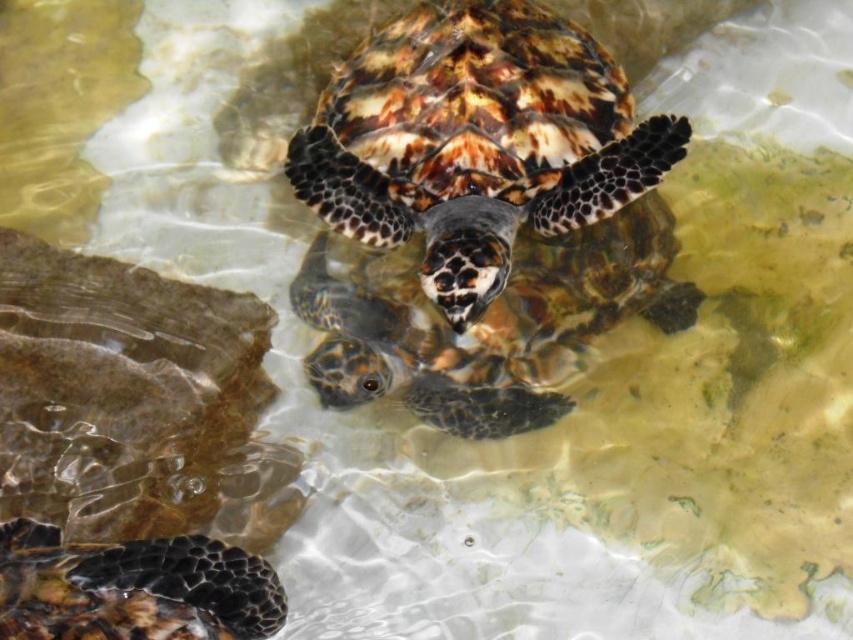
Between leopard print shell at center and patterned shell at lower left, which one is positioned higher?

leopard print shell at center is above.

You are a GUI agent. You are given a task and a screenshot of the screen. Output one action in this format:
    pyautogui.click(x=<x>, y=<y>)
    Task: Click on the leopard print shell at center
    This screenshot has height=640, width=853.
    Given the screenshot: What is the action you would take?
    pyautogui.click(x=476, y=141)

Is point (514, 154) closer to camera compared to point (59, 632)?

No, it is behind (59, 632).

Identify the location of leopard print shell at center. (476, 141).

Can you confirm if leopard print shell at center is positioned to the left of leathery brown tortoise at center?

Incorrect, leopard print shell at center is not on the left side of leathery brown tortoise at center.

The height and width of the screenshot is (640, 853). What do you see at coordinates (476, 141) in the screenshot?
I see `leopard print shell at center` at bounding box center [476, 141].

This screenshot has height=640, width=853. In order to click on leopard print shell at center in this screenshot , I will do `click(476, 141)`.

Can you confirm if patterned shell at lower left is positioned to the right of leathery brown tortoise at center?

In fact, patterned shell at lower left is to the left of leathery brown tortoise at center.

Is point (1, 620) farther from viewer compared to point (454, 348)?

That is False.

The height and width of the screenshot is (640, 853). I want to click on patterned shell at lower left, so click(132, 588).